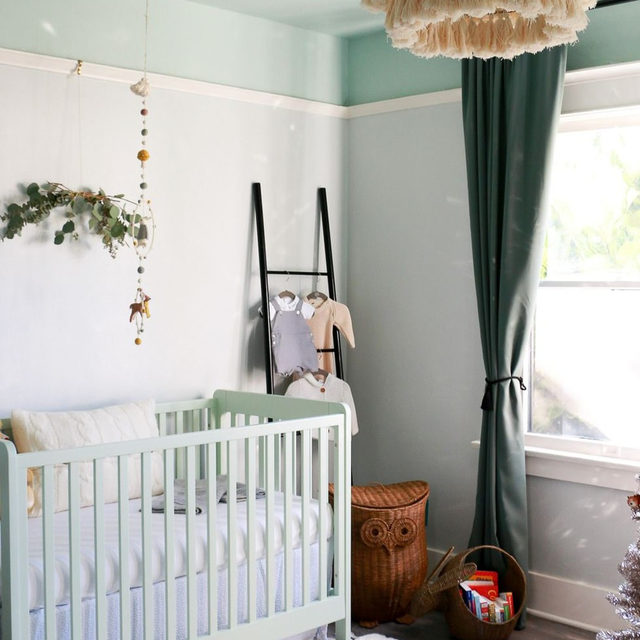
The width and height of the screenshot is (640, 640). I want to click on mattress, so click(180, 537).